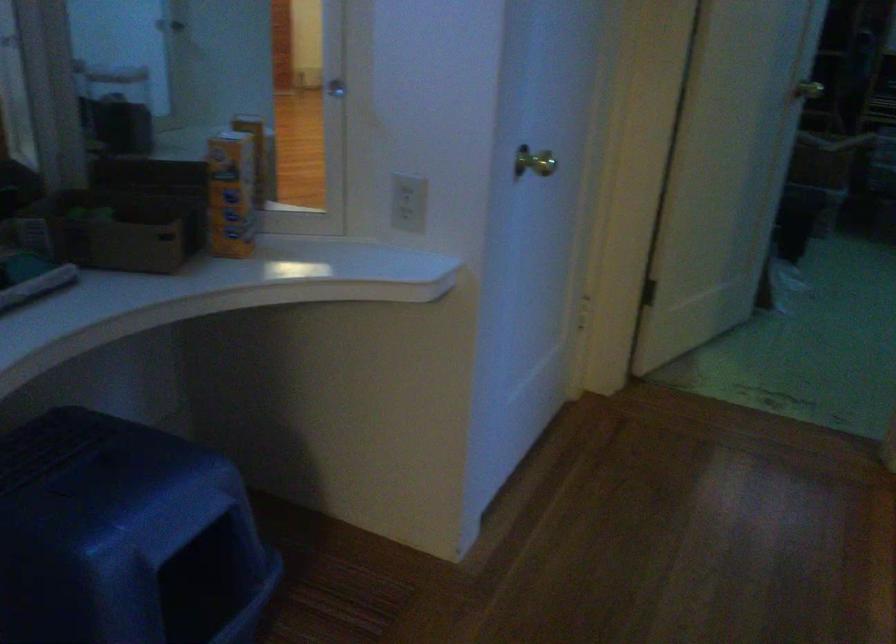
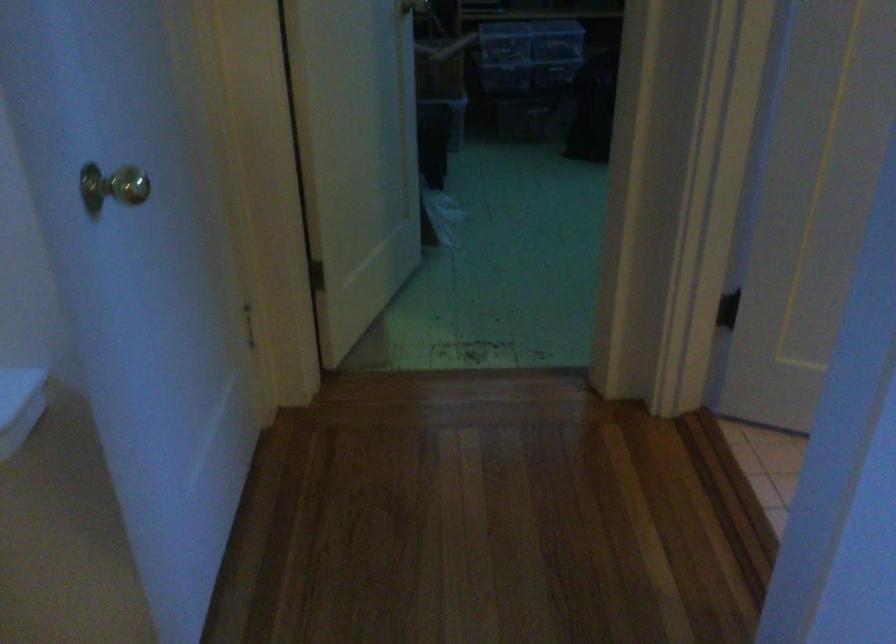
Question: What movement of the cameraman would produce the second image?

Choices:
 (A) Left
 (B) Right
 (C) Forward
 (D) Backward

Answer: (C)